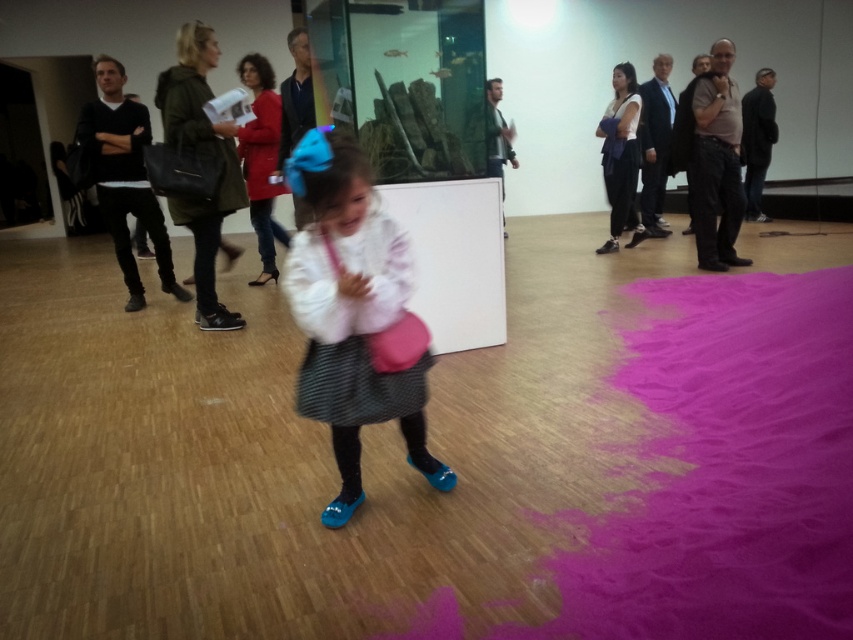
Question: Does green matte jacket at upper left appear on the right side of red wool coat at center?

Choices:
 (A) no
 (B) yes

Answer: (A)

Question: Which object is farther from the camera taking this photo?

Choices:
 (A) red wool coat at center
 (B) dark gray pants at center

Answer: (B)

Question: Which object is closer to the camera taking this photo?

Choices:
 (A) matte white blouse at center
 (B) black leather jacket at left
 (C) dark gray pants at center

Answer: (A)

Question: Can you confirm if matte white blouse at center is bigger than green matte jacket at upper left?

Choices:
 (A) no
 (B) yes

Answer: (A)

Question: Estimate the real-world distances between objects in this image. Which object is closer to the green matte jacket at upper left?

Choices:
 (A) dark gray pants at center
 (B) matte white blouse at center

Answer: (B)

Question: Can you confirm if red wool coat at center is smaller than dark gray pants at center?

Choices:
 (A) no
 (B) yes

Answer: (B)